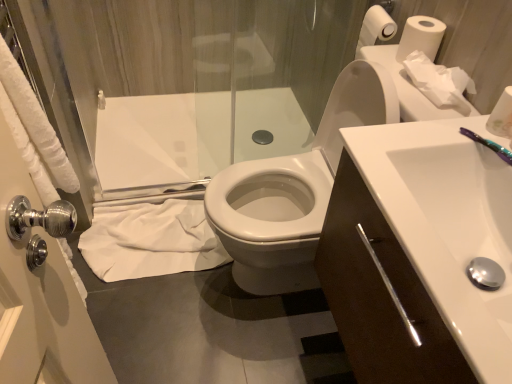
This screenshot has height=384, width=512. In order to click on vacant region under white cloth at lower left (from a real-world perspective) in this screenshot , I will do `click(146, 232)`.